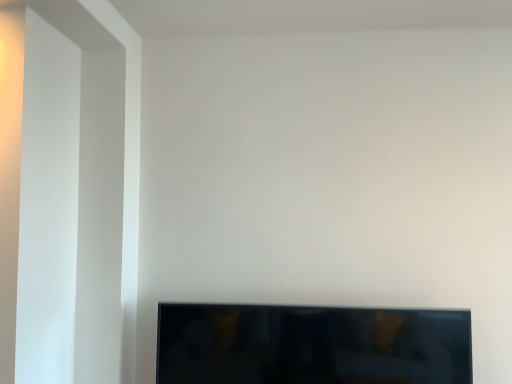
What do you see at coordinates (311, 345) in the screenshot? The width and height of the screenshot is (512, 384). I see `black glossy tv at lower center` at bounding box center [311, 345].

What is the approximate width of black glossy tv at lower center?

The width of black glossy tv at lower center is 12.75 inches.

Locate an element on the screen. black glossy tv at lower center is located at coordinates [311, 345].

This screenshot has width=512, height=384. What are the coordinates of `black glossy tv at lower center` in the screenshot? It's located at (311, 345).